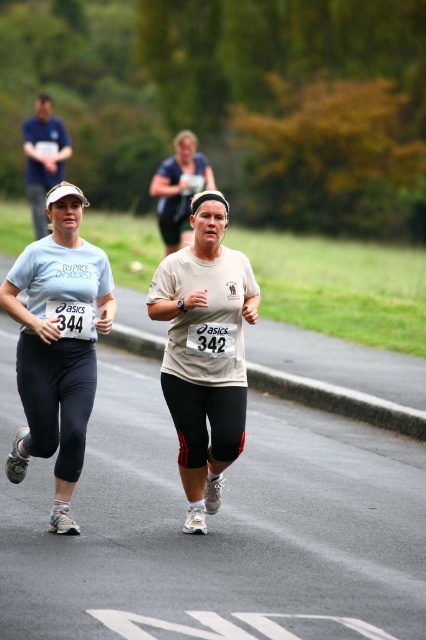
You are a photographer standing at the starting line of a race. You want to take a photo of the white matte running shirt at center. Where should you aim your camera?

You should aim your camera at point (204, 352) to capture the white matte running shirt at center.

From the picture: You are a photographer positioned at the starting line of the race. You need to capture a photo that includes both the white matte running shirt at center and the other runner. Given their current distance apart, will you be able to frame both runners in a single shot without zooming?

The two runners are 7.28 meters apart. Since the photographer is at the starting line, capturing both in a single shot without zooming depends on the camera lens field of view. However, 7.28 meters is a considerable distance, so it might be challenging unless using a wide angle lens.

You are a photographer at the running event. You need to capture a photo where both the white matte running shirt at center and the dark blue shirt at upper left are visible. Based on their heights, which shirt should you focus on first to ensure both are in frame?

The white matte running shirt at center has a lesser height compared to the dark blue shirt at upper left. To ensure both are in frame, focus on positioning the camera to include the taller dark blue shirt at upper left first, then adjust to include the shorter white matte running shirt at center.